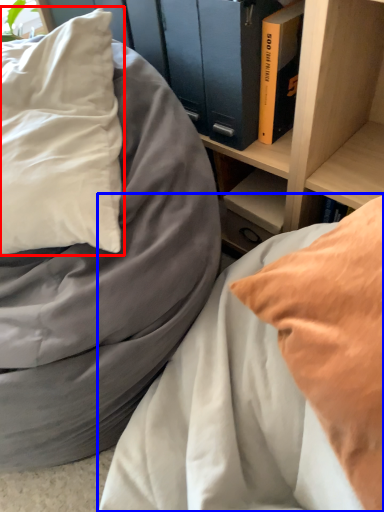
Question: Which object appears closest to the camera in this image, pillow (highlighted by a red box) or bed (highlighted by a blue box)?

Choices:
 (A) pillow
 (B) bed

Answer: (B)